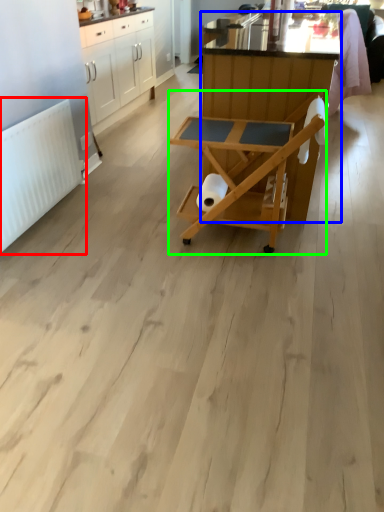
Question: Considering the real-world distances, which object is farthest from radiator (highlighted by a red box)? table (highlighted by a blue box) or table (highlighted by a green box)?

Choices:
 (A) table
 (B) table

Answer: (A)